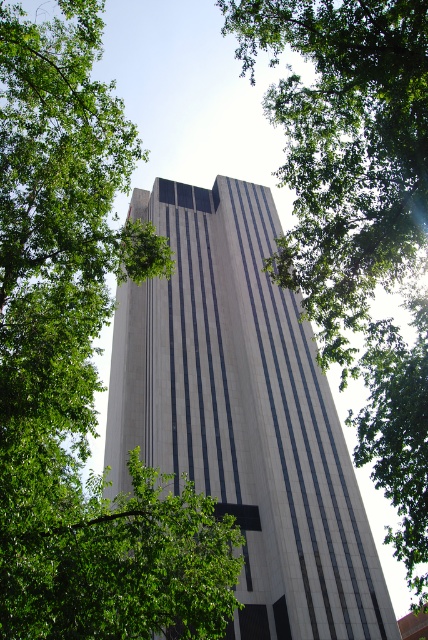
Image resolution: width=428 pixels, height=640 pixels. Describe the element at coordinates (80, 364) in the screenshot. I see `green leafy tree at center` at that location.

Is point (74, 260) positioned before point (253, 4)?

Yes.

Does point (89, 509) lie in front of point (419, 516)?

Yes, point (89, 509) is in front of point (419, 516).

Image resolution: width=428 pixels, height=640 pixels. Identify the location of green leafy tree at center. (80, 364).

Locate an element on the screen. The width and height of the screenshot is (428, 640). white marble tower at center is located at coordinates (243, 416).

Looking at this image, does white marble tower at center have a larger size compared to green leafy tree at upper left?

Actually, white marble tower at center might be smaller than green leafy tree at upper left.

This screenshot has width=428, height=640. In order to click on white marble tower at center in this screenshot , I will do `click(243, 416)`.

Locate an element on the screen. The width and height of the screenshot is (428, 640). white marble tower at center is located at coordinates (243, 416).

Does green leafy tree at center appear on the right side of white marble tower at center?

Incorrect, green leafy tree at center is not on the right side of white marble tower at center.

At what (x,y) coordinates should I click in order to perform the action: click on green leafy tree at center. Please return your answer as a coordinate pair (x, y). The width and height of the screenshot is (428, 640). Looking at the image, I should click on (80, 364).